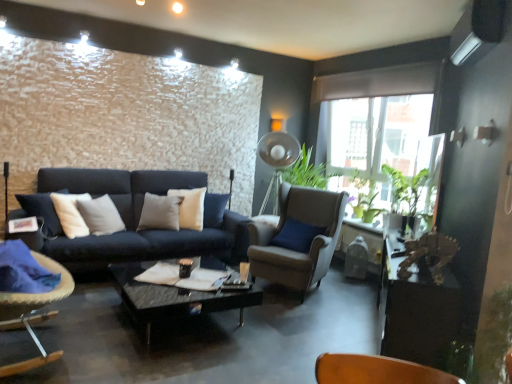
Question: Is suede beige armchair at center, which appears as the second chair when viewed from the front, to the left of wooden table at right from the viewer's perspective?

Choices:
 (A) no
 (B) yes

Answer: (B)

Question: Considering the relative sizes of suede beige armchair at center, marked as the first chair in a right-to-left arrangement, and wooden table at right in the image provided, is suede beige armchair at center, marked as the first chair in a right-to-left arrangement, smaller than wooden table at right?

Choices:
 (A) yes
 (B) no

Answer: (B)

Question: Does suede beige armchair at center, marked as the first chair in a right-to-left arrangement, have a greater width compared to wooden table at right?

Choices:
 (A) no
 (B) yes

Answer: (B)

Question: Are suede beige armchair at center, positioned as the second chair in left-to-right order, and wooden table at right located far from each other?

Choices:
 (A) no
 (B) yes

Answer: (B)

Question: Does suede beige armchair at center, positioned as the second chair in left-to-right order, have a larger size compared to wooden table at right?

Choices:
 (A) no
 (B) yes

Answer: (B)

Question: Would you say suede beige armchair at center, positioned as the second chair in left-to-right order, contains wooden table at right?

Choices:
 (A) no
 (B) yes

Answer: (A)

Question: Is wooden table at right positioned behind suede beige armchair at center, marked as the first chair in a right-to-left arrangement?

Choices:
 (A) yes
 (B) no

Answer: (B)

Question: Is wooden table at right at the right side of suede beige armchair at center, which appears as the second chair when viewed from the front?

Choices:
 (A) no
 (B) yes

Answer: (B)

Question: Considering the relative sizes of wooden table at right and suede beige armchair at center, which appears as the second chair when viewed from the front, in the image provided, is wooden table at right taller than suede beige armchair at center, which appears as the second chair when viewed from the front,?

Choices:
 (A) no
 (B) yes

Answer: (A)

Question: Is wooden table at right turned away from suede beige armchair at center, marked as the first chair in a right-to-left arrangement?

Choices:
 (A) no
 (B) yes

Answer: (A)

Question: Is wooden table at right positioned before suede beige armchair at center, positioned as the second chair in left-to-right order?

Choices:
 (A) no
 (B) yes

Answer: (B)

Question: Considering the relative positions of wooden table at right and suede beige armchair at center, positioned as the second chair in left-to-right order, in the image provided, is wooden table at right to the left of suede beige armchair at center, positioned as the second chair in left-to-right order, from the viewer's perspective?

Choices:
 (A) no
 (B) yes

Answer: (A)

Question: Is green matte plant at right to the right of velvet cushioned chair at left, the first chair from the front, from the viewer's perspective?

Choices:
 (A) yes
 (B) no

Answer: (A)